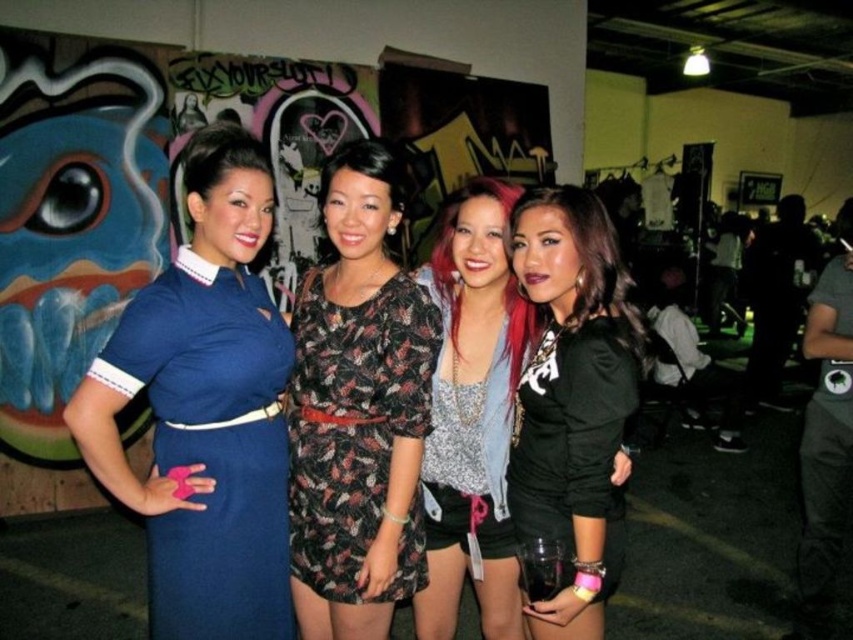
You are standing at the origin of the coordinate system in the image. You see two points, point (595, 483) and point (326, 518). Which point is closer to you?

Point (595, 483) is in front of point (326, 518), so it is closer to you.

You are a photographer trying to capture a group photo. You notice the blue fabric dress at left and the sparkly silver top at center. Based on their heights, which clothing item should you adjust to ensure both are fully visible in the photo?

The blue fabric dress at left is not as tall as the sparkly silver top at center. To ensure both are fully visible, you should lower the camera angle slightly so that the shorter blue fabric dress at left is not obscured by the taller sparkly silver top at center.